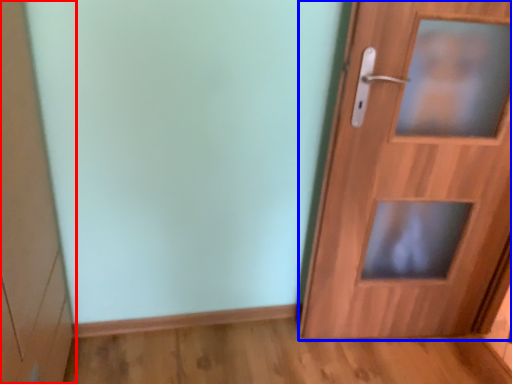
Question: Among these objects, which one is farthest to the camera, cabinetry (highlighted by a red box) or door (highlighted by a blue box)?

Choices:
 (A) cabinetry
 (B) door

Answer: (B)